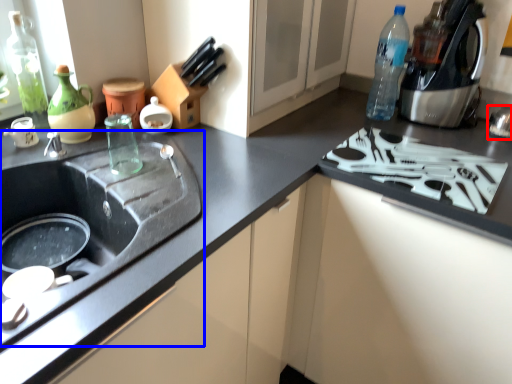
Question: Which of the following is the farthest to the observer, appliance (highlighted by a red box) or sink (highlighted by a blue box)?

Choices:
 (A) appliance
 (B) sink

Answer: (A)